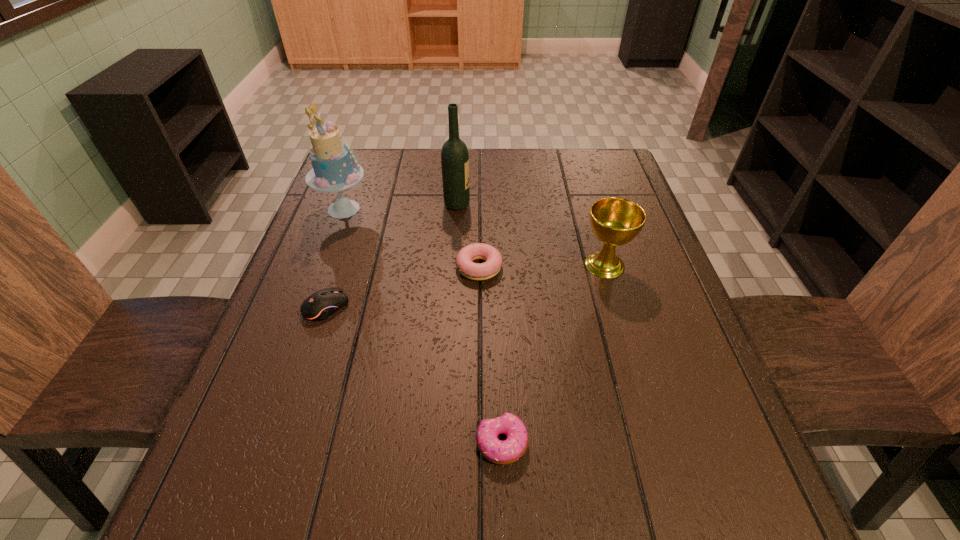
Find the location of a particular element. This screenshot has height=540, width=960. cake is located at coordinates (334, 170).

The width and height of the screenshot is (960, 540). I want to click on wine bottle, so coord(454,155).

This screenshot has width=960, height=540. I want to click on chalice, so click(615, 221).

Locate an element on the screen. The width and height of the screenshot is (960, 540). the rightmost object is located at coordinates (615, 221).

Identify the location of the farther doughnut. The width and height of the screenshot is (960, 540). (475, 271).

Image resolution: width=960 pixels, height=540 pixels. I want to click on computer mouse, so click(322, 304).

Find the location of `the nearest object`. the nearest object is located at coordinates (505, 452).

Identify the location of vacant space located with a ladder on the side of the cake. (436, 209).

Identify the location of free space located on the labeled side of the wine bottle. (535, 205).

Identify the location of vacant region located 0.050m on the right of the chalice. The width and height of the screenshot is (960, 540). (650, 265).